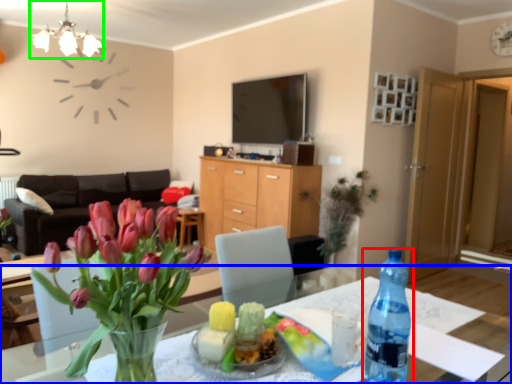
Question: Estimate the real-world distances between objects in this image. Which object is farther from bottle (highlighted by a red box), desk (highlighted by a blue box) or light fixture (highlighted by a green box)?

Choices:
 (A) desk
 (B) light fixture

Answer: (B)